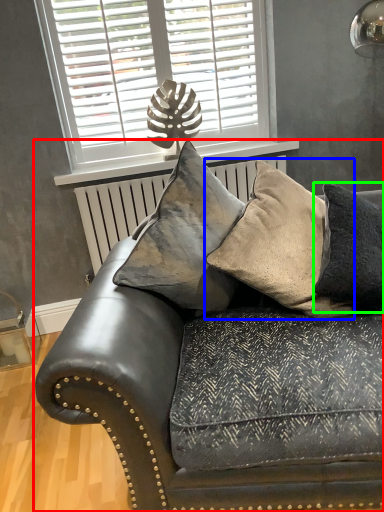
Question: Which is nearer to the studio couch (highlighted by a red box)? pillow (highlighted by a blue box) or pillow (highlighted by a green box).

Choices:
 (A) pillow
 (B) pillow

Answer: (A)